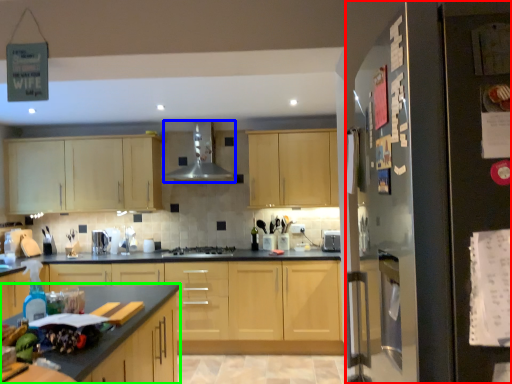
Question: Estimate the real-world distances between objects in this image. Which object is closer to fridge (highlighted by a red box), exhaust hood (highlighted by a blue box) or countertop (highlighted by a green box)?

Choices:
 (A) exhaust hood
 (B) countertop

Answer: (B)